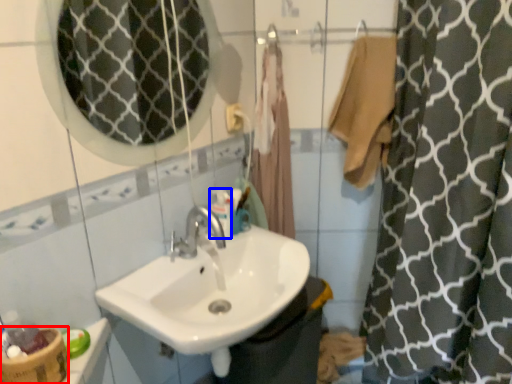
Question: Among these objects, which one is nearest to the camera, basket (highlighted by a red box) or mouthwash (highlighted by a blue box)?

Choices:
 (A) basket
 (B) mouthwash

Answer: (A)